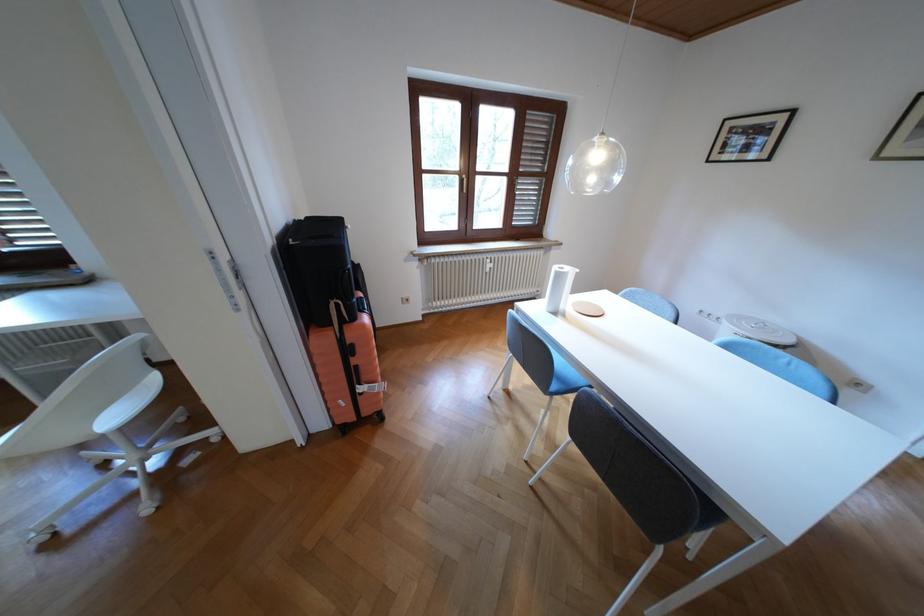
Locate an element on the screen. This screenshot has width=924, height=616. blue chair sitting surface is located at coordinates (566, 371).